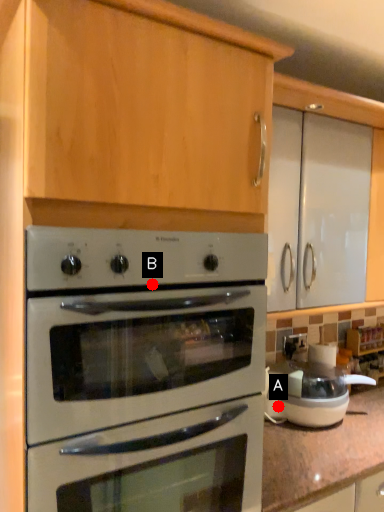
Question: Two points are circled on the image, labeled by A and B beside each circle. Which point is farther from the camera taking this photo?

Choices:
 (A) A is further
 (B) B is further

Answer: (A)